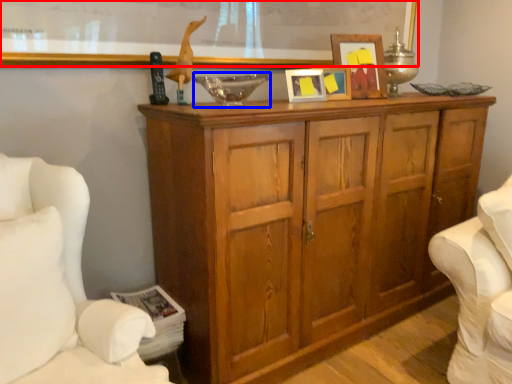
Question: Which point is further to the camera, bulletin board (highlighted by a red box) or glass bowl (highlighted by a blue box)?

Choices:
 (A) bulletin board
 (B) glass bowl

Answer: (B)